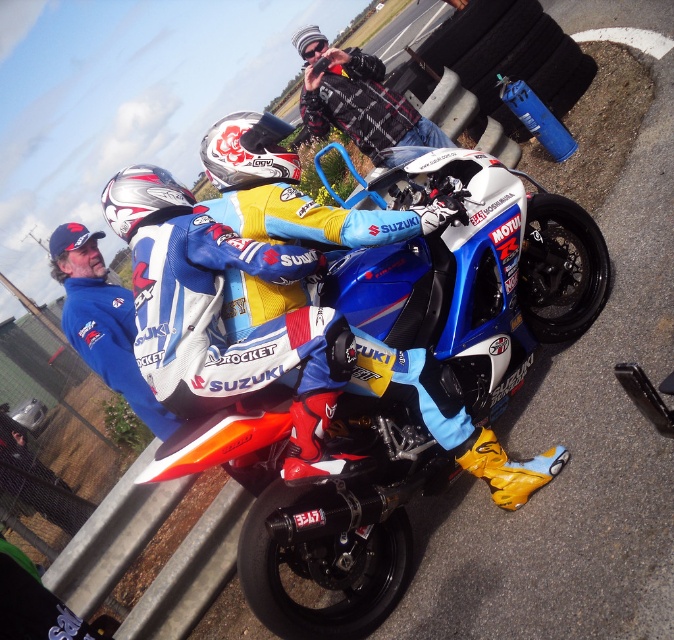
Is blue fabric jacket at left taller than white matte helmet at upper center?

Indeed, blue fabric jacket at left has a greater height compared to white matte helmet at upper center.

Does blue fabric jacket at left have a smaller size compared to white matte helmet at upper center?

Incorrect, blue fabric jacket at left is not smaller in size than white matte helmet at upper center.

Image resolution: width=674 pixels, height=640 pixels. In order to click on blue fabric jacket at left in this screenshot , I will do `click(102, 323)`.

Is matte blue and white racing suit at center above blue fabric jacket at left?

Actually, matte blue and white racing suit at center is below blue fabric jacket at left.

Is point (257, 324) closer to camera compared to point (84, 284)?

Yes, it is in front of point (84, 284).

Locate an element on the screen. This screenshot has height=640, width=674. matte blue and white racing suit at center is located at coordinates (290, 355).

Identify the location of matte blue and white racing suit at center. The height and width of the screenshot is (640, 674). (290, 355).

Who is higher up, blue fabric jacket at left or silver metallic helmet at upper left?

silver metallic helmet at upper left is above.

What do you see at coordinates (102, 323) in the screenshot?
I see `blue fabric jacket at left` at bounding box center [102, 323].

You are a GUI agent. You are given a task and a screenshot of the screen. Output one action in this format:
    pyautogui.click(x=<x>, y=<y>)
    Task: Click on the blue fabric jacket at left
    
    Given the screenshot: What is the action you would take?
    pyautogui.click(x=102, y=323)